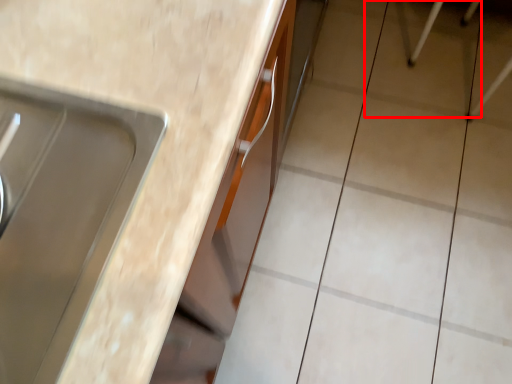
Question: From the image's perspective, where is ceramic tile (annotated by the red box) located relative to countertop?

Choices:
 (A) above
 (B) below

Answer: (A)